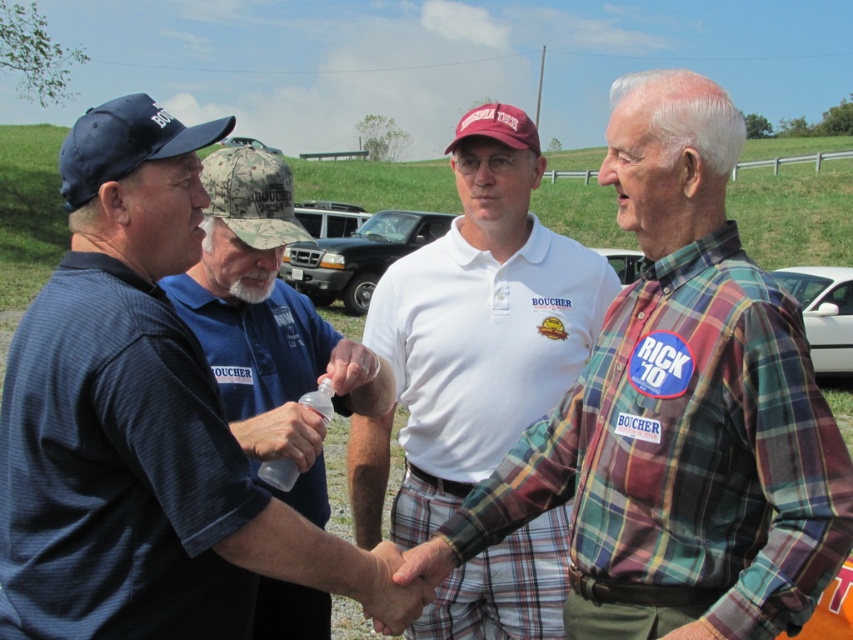
Is blue striped shirt at left shorter than black matte truck at center?

No, blue striped shirt at left is not shorter than black matte truck at center.

Does blue striped shirt at left have a greater height compared to black matte truck at center?

Yes, blue striped shirt at left is taller than black matte truck at center.

Does point (163, 308) come farther from viewer compared to point (352, 276)?

No, (163, 308) is in front of (352, 276).

At what (x,y) coordinates should I click in order to perform the action: click on blue striped shirt at left. Please return your answer as a coordinate pair (x, y). The height and width of the screenshot is (640, 853). Looking at the image, I should click on (141, 426).

Which is in front, point (450, 586) or point (630, 282)?

Point (450, 586) is more forward.

Who is more forward, (386, 276) or (612, 262)?

Point (386, 276) is more forward.

The height and width of the screenshot is (640, 853). I want to click on white cotton polo shirt at center, so click(480, 321).

Where is `blue striped shirt at left`? The height and width of the screenshot is (640, 853). blue striped shirt at left is located at coordinates (141, 426).

Is point (166, 320) closer to camera compared to point (242, 136)?

Yes, point (166, 320) is closer to viewer.

Who is more distant from viewer, (x=112, y=369) or (x=225, y=138)?

Positioned behind is point (x=225, y=138).

Locate an element on the screen. The image size is (853, 640). blue striped shirt at left is located at coordinates pos(141,426).